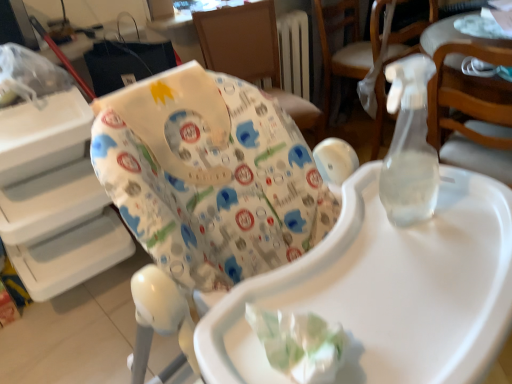
Question: From a real-world perspective, does white fabric highchair at center, which is the first chair in left-to-right order, sit lower than white fabric baby seat at upper center?

Choices:
 (A) no
 (B) yes

Answer: (A)

Question: Does white fabric highchair at center, the 2th chair from the right, have a lesser width compared to white fabric baby seat at upper center?

Choices:
 (A) yes
 (B) no

Answer: (B)

Question: Considering the relative sizes of white fabric highchair at center, the 2th chair from the right, and white fabric baby seat at upper center in the image provided, is white fabric highchair at center, the 2th chair from the right, wider than white fabric baby seat at upper center?

Choices:
 (A) no
 (B) yes

Answer: (B)

Question: Is white fabric highchair at center, the 2th chair from the right, not inside white fabric baby seat at upper center?

Choices:
 (A) no
 (B) yes

Answer: (B)

Question: Is white fabric highchair at center, the 2th chair from the right, at the right side of white fabric baby seat at upper center?

Choices:
 (A) no
 (B) yes

Answer: (B)

Question: From the image's perspective, relative to wooden chair at upper right, arranged as the 1th chair when viewed from the right, is white fabric highchair at center, the 2th chair from the right, above or below?

Choices:
 (A) below
 (B) above

Answer: (A)

Question: In terms of height, does white fabric highchair at center, which is the first chair in left-to-right order, look taller or shorter compared to wooden chair at upper right, placed as the second chair when sorted from left to right?

Choices:
 (A) tall
 (B) short

Answer: (B)

Question: Considering the positions of white fabric highchair at center, the 2th chair from the right, and wooden chair at upper right, arranged as the 1th chair when viewed from the right, in the image, is white fabric highchair at center, the 2th chair from the right, wider or thinner than wooden chair at upper right, arranged as the 1th chair when viewed from the right,?

Choices:
 (A) wide
 (B) thin

Answer: (A)

Question: In terms of size, does white fabric highchair at center, which is the first chair in left-to-right order, appear bigger or smaller than wooden chair at upper right, arranged as the 1th chair when viewed from the right?

Choices:
 (A) big
 (B) small

Answer: (A)

Question: Is white fabric highchair at center, which is the first chair in left-to-right order, taller or shorter than white fabric baby seat at upper center?

Choices:
 (A) tall
 (B) short

Answer: (B)

Question: Considering the relative positions of white fabric highchair at center, which is the first chair in left-to-right order, and white fabric baby seat at upper center in the image provided, is white fabric highchair at center, which is the first chair in left-to-right order, to the left or to the right of white fabric baby seat at upper center?

Choices:
 (A) right
 (B) left

Answer: (A)

Question: From a real-world perspective, is white fabric highchair at center, which is the first chair in left-to-right order, physically located above or below white fabric baby seat at upper center?

Choices:
 (A) below
 (B) above

Answer: (B)

Question: In terms of width, does white fabric highchair at center, the 2th chair from the right, look wider or thinner when compared to white fabric baby seat at upper center?

Choices:
 (A) wide
 (B) thin

Answer: (A)

Question: In terms of height, does white fabric highchair at center, the 2th chair from the right, look taller or shorter compared to white glossy table at upper right?

Choices:
 (A) tall
 (B) short

Answer: (A)

Question: Based on their sizes in the image, would you say white fabric highchair at center, which is the first chair in left-to-right order, is bigger or smaller than white glossy table at upper right?

Choices:
 (A) big
 (B) small

Answer: (A)